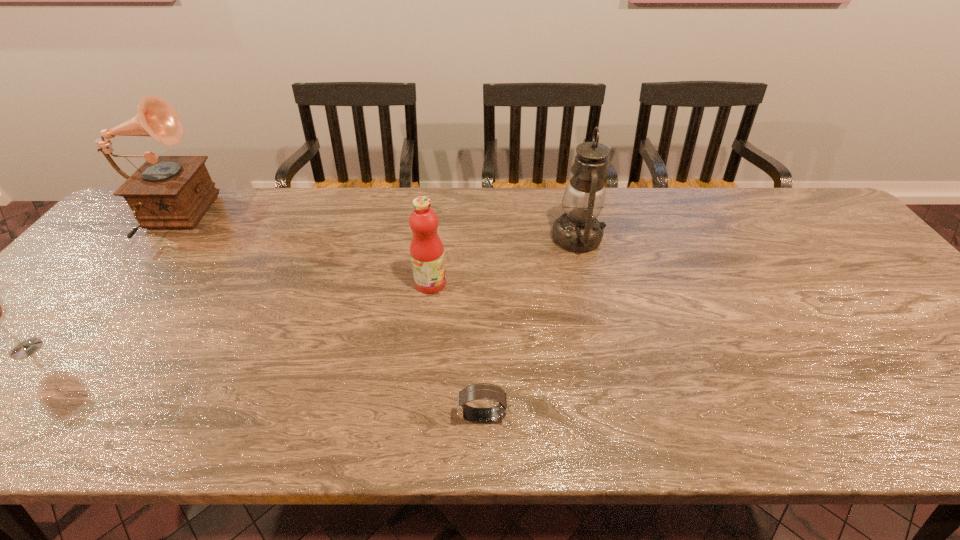
Where is `vacant space at the right edge of the desktop`? This screenshot has height=540, width=960. vacant space at the right edge of the desktop is located at coordinates (834, 271).

Identify the location of vacant space at the far left corner of the desktop. Image resolution: width=960 pixels, height=540 pixels. (131, 232).

Where is `free space between the record player and the oil lamp`? free space between the record player and the oil lamp is located at coordinates (372, 229).

In order to click on free space between the rightmost object and the second object from right to left in this screenshot , I will do `click(530, 327)`.

Locate an element on the screen. This screenshot has height=540, width=960. free spot between the oil lamp and the third object from left to right is located at coordinates (504, 260).

In order to click on free space between the rightmost object and the record player in this screenshot , I will do `click(372, 229)`.

This screenshot has width=960, height=540. I want to click on free space between the rightmost object and the record player, so click(x=372, y=229).

Point out which object is positioned as the second nearest to the record player. Please provide its 2D coordinates. Your answer should be formatted as a tuple, i.e. [(x, y)], where the tuple contains the x and y coordinates of a point satisfying the conditions above.

[(426, 249)]

Locate which object is the closest to the third nearest object. Please provide its 2D coordinates. Your answer should be formatted as a tuple, i.e. [(x, y)], where the tuple contains the x and y coordinates of a point satisfying the conditions above.

[(578, 230)]

The height and width of the screenshot is (540, 960). I want to click on blank area in the image that satisfies the following two spatial constraints: 1. on the horn of the record player; 2. on the left side of the rightmost object, so click(x=154, y=238).